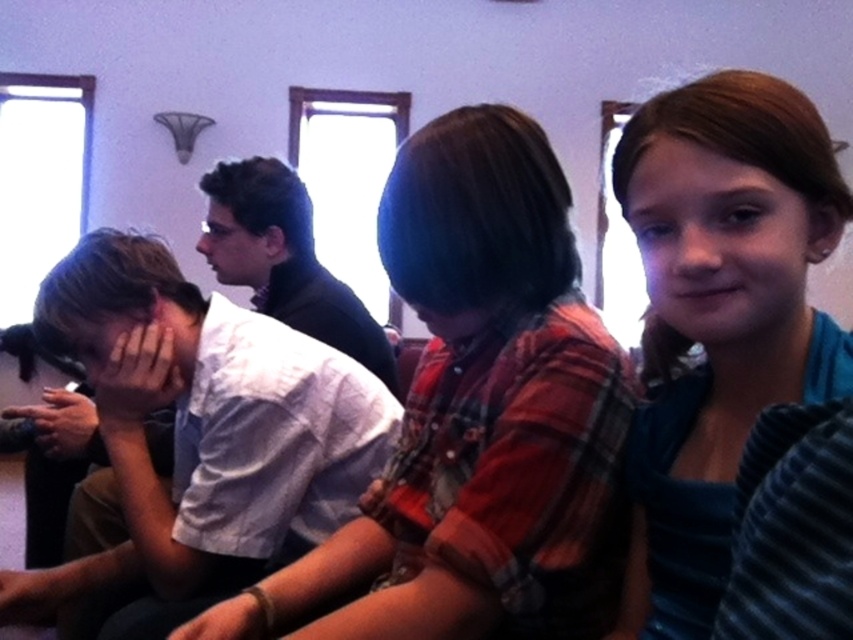
Is smooth brown hair at upper right positioned at the back of matte black hair at center?

That is False.

Between smooth brown hair at upper right and matte black hair at center, which one is positioned higher?

matte black hair at center

Locate an element on the screen. Image resolution: width=853 pixels, height=640 pixels. smooth brown hair at upper right is located at coordinates click(x=718, y=317).

How far apart are dark blue shirt at center and smooth skin hand at center left?

dark blue shirt at center is 29.28 inches from smooth skin hand at center left.

Between dark blue shirt at center and smooth skin hand at center left, which one appears on the right side from the viewer's perspective?

dark blue shirt at center is more to the right.

Where is `dark blue shirt at center`? The height and width of the screenshot is (640, 853). dark blue shirt at center is located at coordinates (283, 259).

Can you confirm if smooth skin hand at center left is positioned to the left of matte black hair at center?

No, smooth skin hand at center left is not to the left of matte black hair at center.

Is smooth skin hand at center left taller than matte black hair at center?

Incorrect, smooth skin hand at center left's height is not larger of matte black hair at center's.

The height and width of the screenshot is (640, 853). Identify the location of smooth skin hand at center left. [135, 376].